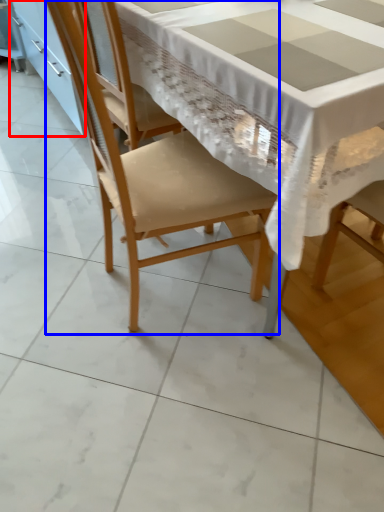
Question: Which object appears closest to the camera in this image, cabinetry (highlighted by a red box) or chair (highlighted by a blue box)?

Choices:
 (A) cabinetry
 (B) chair

Answer: (B)